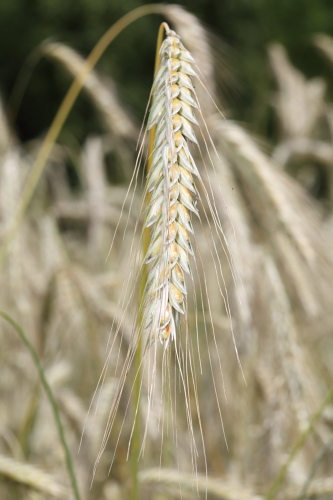
Locate an element on the screen. green plants is located at coordinates click(x=59, y=424), click(x=141, y=293), click(x=295, y=454), click(x=315, y=472), click(x=166, y=455).